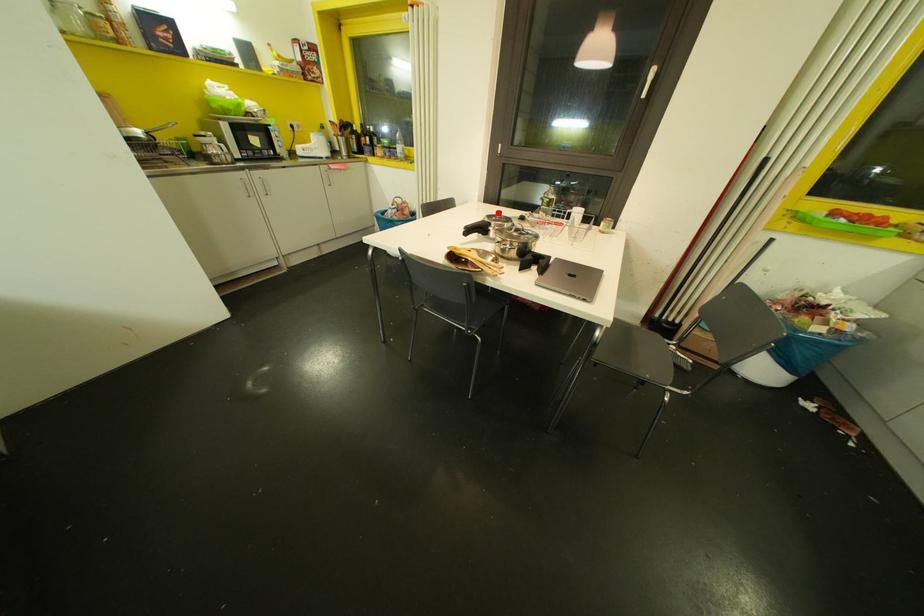
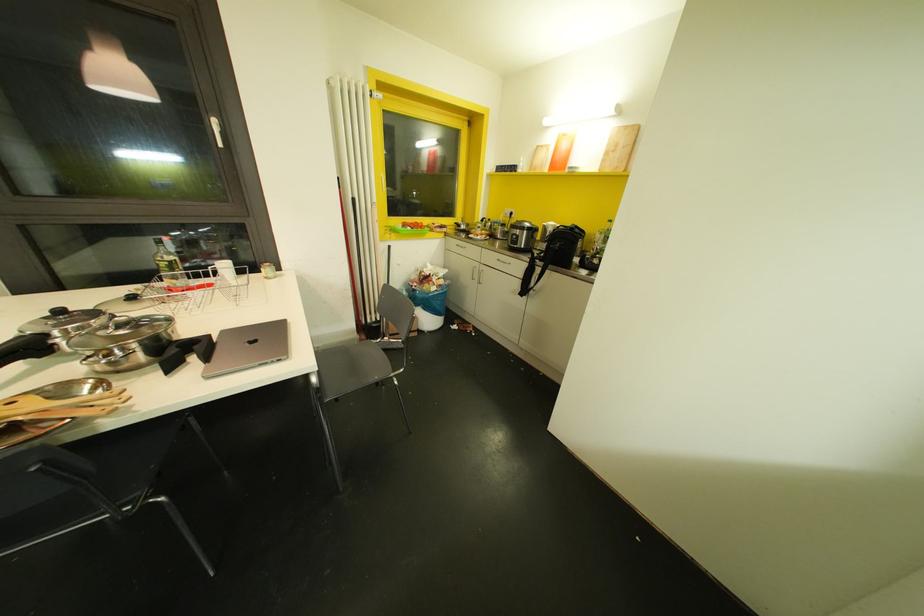
Question: I am providing you with two images of the same scene from different viewpoints. A red point is marked on the first image. At the location where the point appears in image 1, is it still visible in image 2?

Choices:
 (A) Yes
 (B) No

Answer: (A)